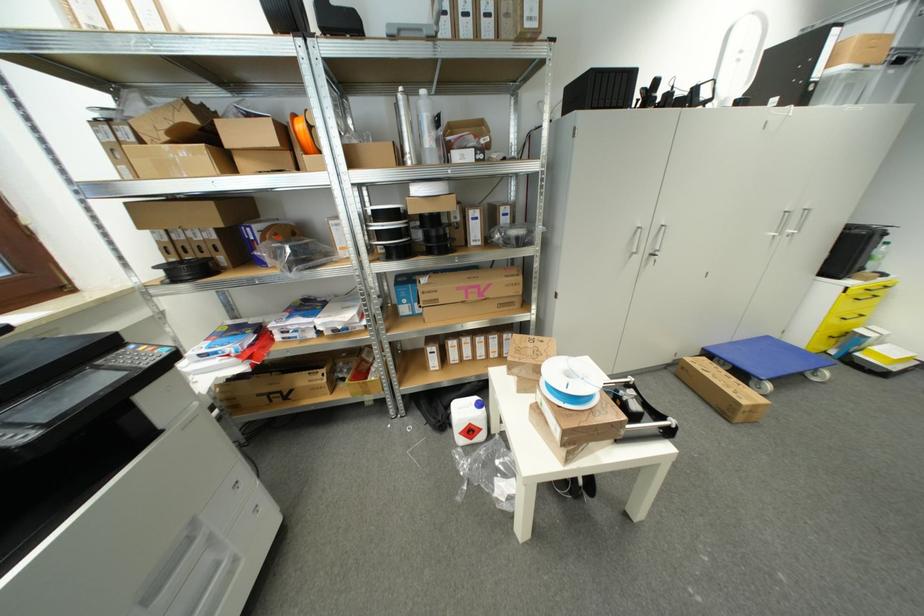
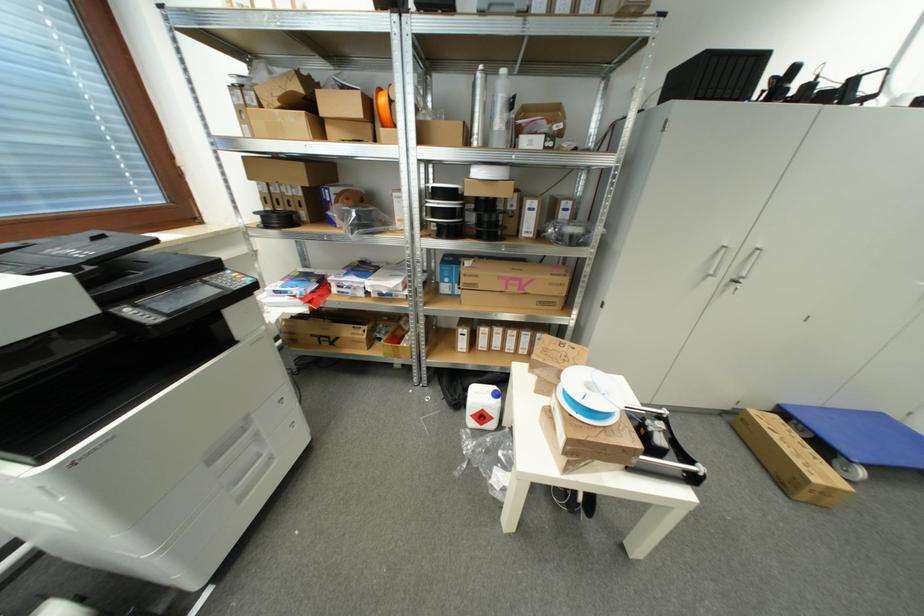
Where in the second image is the point corresponding to pixel 305 129 from the first image?

(387, 103)